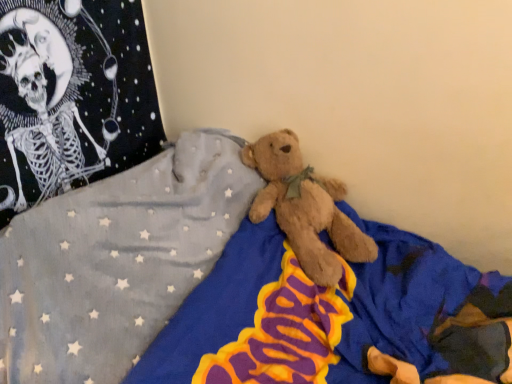
Question: Considering the relative sizes of soft plush bear at center and fuzzy brown teddy bear at upper left in the image provided, is soft plush bear at center thinner than fuzzy brown teddy bear at upper left?

Choices:
 (A) yes
 (B) no

Answer: (B)

Question: Does soft plush bear at center have a larger size compared to fuzzy brown teddy bear at upper left?

Choices:
 (A) yes
 (B) no

Answer: (A)

Question: Is soft plush bear at center wider than fuzzy brown teddy bear at upper left?

Choices:
 (A) no
 (B) yes

Answer: (B)

Question: Is the depth of soft plush bear at center greater than that of fuzzy brown teddy bear at upper left?

Choices:
 (A) no
 (B) yes

Answer: (A)

Question: From the image's perspective, is soft plush bear at center over fuzzy brown teddy bear at upper left?

Choices:
 (A) no
 (B) yes

Answer: (A)

Question: From the image's perspective, is soft plush bear at center under fuzzy brown teddy bear at upper left?

Choices:
 (A) yes
 (B) no

Answer: (A)

Question: Is fuzzy brown teddy bear at upper left closer to camera compared to soft plush bear at center?

Choices:
 (A) yes
 (B) no

Answer: (B)

Question: Is fuzzy brown teddy bear at upper left to the left of soft plush bear at center from the viewer's perspective?

Choices:
 (A) yes
 (B) no

Answer: (A)

Question: Is fuzzy brown teddy bear at upper left placed right next to soft plush bear at center?

Choices:
 (A) yes
 (B) no

Answer: (B)

Question: From a real-world perspective, is fuzzy brown teddy bear at upper left positioned over soft plush bear at center based on gravity?

Choices:
 (A) no
 (B) yes

Answer: (B)

Question: Is fuzzy brown teddy bear at upper left wider than soft plush bear at center?

Choices:
 (A) yes
 (B) no

Answer: (B)

Question: From the image's perspective, is fuzzy brown teddy bear at upper left over soft plush bear at center?

Choices:
 (A) yes
 (B) no

Answer: (A)

Question: Considering the positions of fuzzy brown teddy bear at upper left and soft plush bear at center in the image, is fuzzy brown teddy bear at upper left wider or thinner than soft plush bear at center?

Choices:
 (A) thin
 (B) wide

Answer: (A)